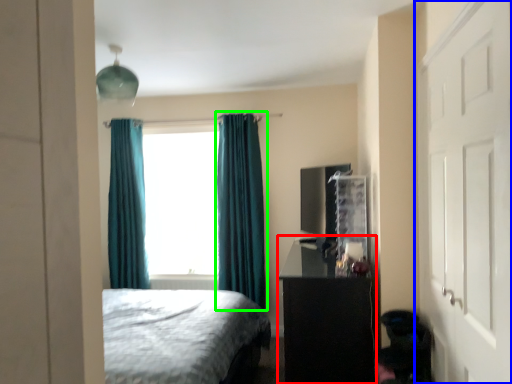
Question: Estimate the real-world distances between objects in this image. Which object is closer to vanity (highlighted by a red box), door (highlighted by a blue box) or curtain (highlighted by a green box)?

Choices:
 (A) door
 (B) curtain

Answer: (A)